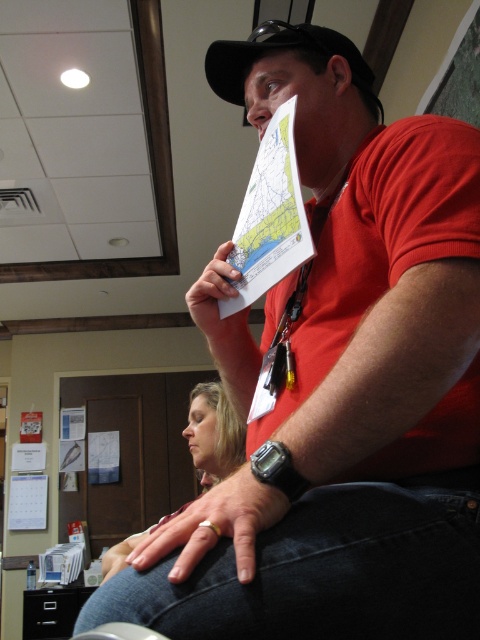
You are standing in the office and need to locate the silver metallic watch. According to the image, where exactly is the silver metallic watch at lower center located?

The silver metallic watch at lower center is located at point (216, 525).

You are a security guard checking badges in an office. You notice the silver metallic watch at lower center and the blonde hair at lower left. Which object is smaller in size?

The silver metallic watch at lower center is smaller in size compared to the blonde hair at lower left.

You are standing in an office and see the black matte baseball cap at upper center and the white paper at center. Which object is positioned more to the right side?

The black matte baseball cap at upper center is positioned more to the right side than the white paper at center.